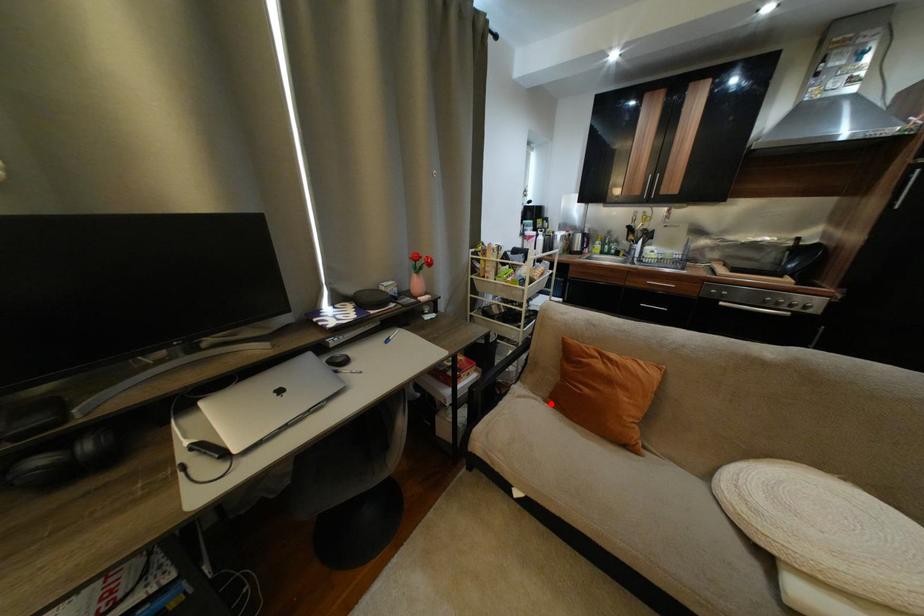
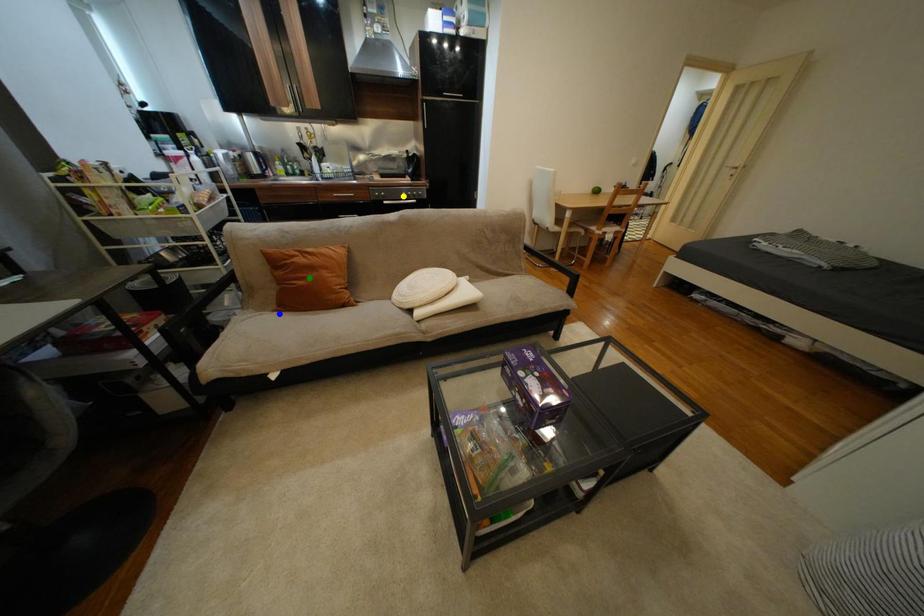
Question: I am providing you with two images of the same scene from different viewpoints. A red point is marked on the first image. You are given multiple points on the second image. Which spot in image 2 lines up with the point in image 1?

Choices:
 (A) blue point
 (B) green point
 (C) yellow point

Answer: (A)